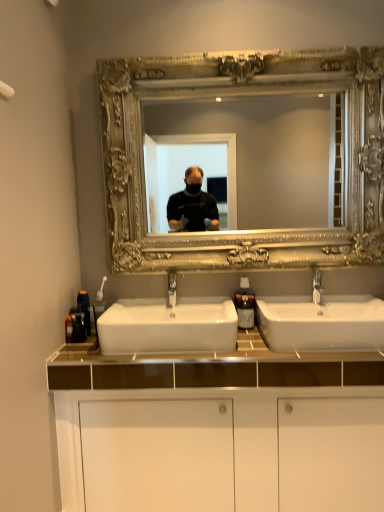
At what (x,y) coordinates should I click in order to perform the action: click on free space to the back side of silver metallic faucet at center. Please return your answer as a coordinate pair (x, y). The height and width of the screenshot is (512, 384). Looking at the image, I should click on (313, 306).